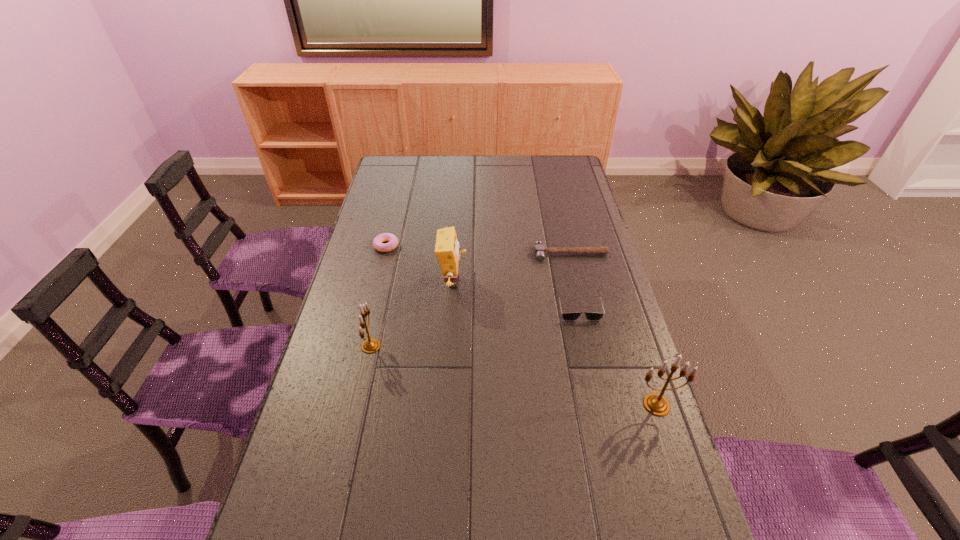
In the image, there is a desktop. Where is `vacant space at the left edge`? This screenshot has height=540, width=960. vacant space at the left edge is located at coordinates (393, 184).

I want to click on vacant space at the right edge of the desktop, so click(x=615, y=452).

Identify the location of free point at the far left corner. This screenshot has height=540, width=960. (383, 168).

The width and height of the screenshot is (960, 540). In order to click on vacant space that's between the shorter candelabrum and the doughnut in this screenshot , I will do pos(378,296).

I want to click on vacant area that lies between the hammer and the left candelabrum, so click(x=470, y=300).

Find the location of `empty space that is in between the hammer and the right candelabrum`. empty space that is in between the hammer and the right candelabrum is located at coordinates (613, 329).

Where is `vacant area between the hammer and the nearest object`? vacant area between the hammer and the nearest object is located at coordinates (613, 329).

Identify the location of free point between the doughnut and the sunglasses. (482, 276).

Find the location of a particular element. free space that is in between the sunglasses and the doughnut is located at coordinates (482, 276).

This screenshot has width=960, height=540. In order to click on free space between the shorter candelabrum and the hammer in this screenshot , I will do `click(470, 300)`.